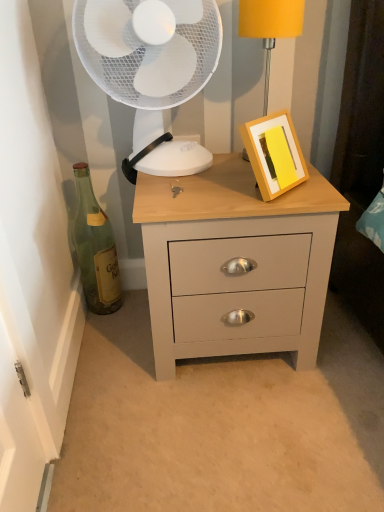
Question: Is white plastic fan at upper center to the left or to the right of green glass bottle at left in the image?

Choices:
 (A) right
 (B) left

Answer: (A)

Question: Does point (107, 37) appear closer or farther from the camera than point (87, 215)?

Choices:
 (A) closer
 (B) farther

Answer: (A)

Question: Estimate the real-world distances between objects in this image. Which object is farther from the matte yellow lampshade at upper right?

Choices:
 (A) matte gray chest of drawers at center
 (B) green glass bottle at left
 (C) yellow matte picture frame at upper right
 (D) white plastic fan at upper center

Answer: (B)

Question: Which object is positioned farthest from the green glass bottle at left?

Choices:
 (A) yellow matte picture frame at upper right
 (B) matte yellow lampshade at upper right
 (C) white plastic fan at upper center
 (D) matte gray chest of drawers at center

Answer: (B)